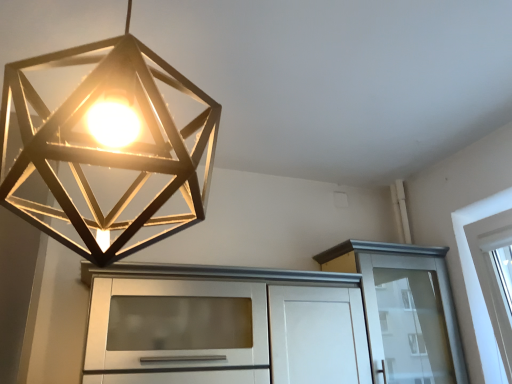
Question: Is white glossy cabinet at center, the 2th cabinetry viewed from the right, to the left or to the right of metallic geometric light at upper center in the image?

Choices:
 (A) right
 (B) left

Answer: (A)

Question: Is point (162, 284) positioned closer to the camera than point (120, 226)?

Choices:
 (A) farther
 (B) closer

Answer: (A)

Question: Based on their relative distances, which object is farther from the metallic geometric light at upper center?

Choices:
 (A) white glossy cabinet at center, which appears as the first cabinetry when viewed from the left
 (B) white glossy cabinet at upper right, positioned as the first cabinetry in right-to-left order

Answer: (B)

Question: Which object is positioned closest to the white glossy cabinet at upper right, the 2th cabinetry from the left?

Choices:
 (A) metallic geometric light at upper center
 (B) white glossy cabinet at center, the 2th cabinetry viewed from the right

Answer: (B)